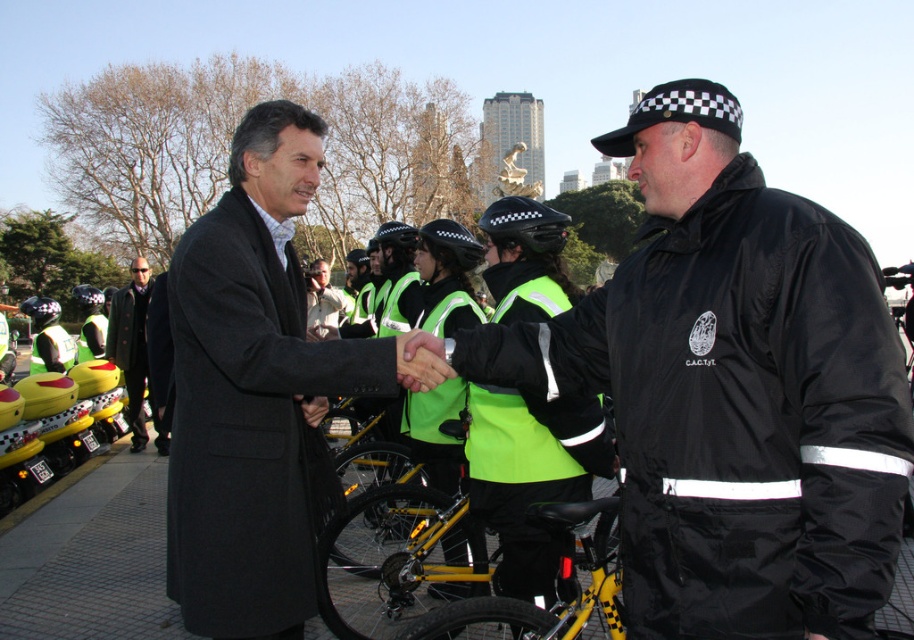
Does black glossy jacket at center have a lesser width compared to matte black coat at center?

Yes.

Is point (867, 625) positioned after point (355, 392)?

That is False.

Find the location of `black glossy jacket at center`. black glossy jacket at center is located at coordinates (731, 390).

Based on the photo, who is positioned more to the right, matte black coat at center or green wool coat at center?

matte black coat at center

Is matte black coat at center above green wool coat at center?

Correct, matte black coat at center is located above green wool coat at center.

Who is more forward, (240, 317) or (119, 304)?

Positioned in front is point (240, 317).

The width and height of the screenshot is (914, 640). What are the coordinates of `matte black coat at center` in the screenshot? It's located at (257, 392).

Is the position of matte black coat at center less distant than that of yellow metallic bicycle at center?

That is False.

Is point (303, 326) closer to camera compared to point (594, 499)?

Yes.

Measure the distance between point (214, 358) and camera.

The distance of point (214, 358) from camera is 94.14 feet.

Image resolution: width=914 pixels, height=640 pixels. What are the coordinates of `matte black coat at center` in the screenshot? It's located at (257, 392).